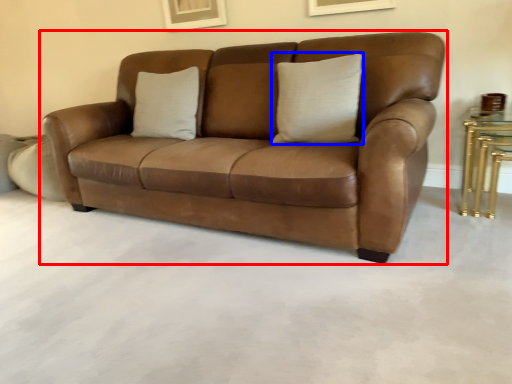
Question: Which object appears closest to the camera in this image, studio couch (highlighted by a red box) or pillow (highlighted by a blue box)?

Choices:
 (A) studio couch
 (B) pillow

Answer: (A)